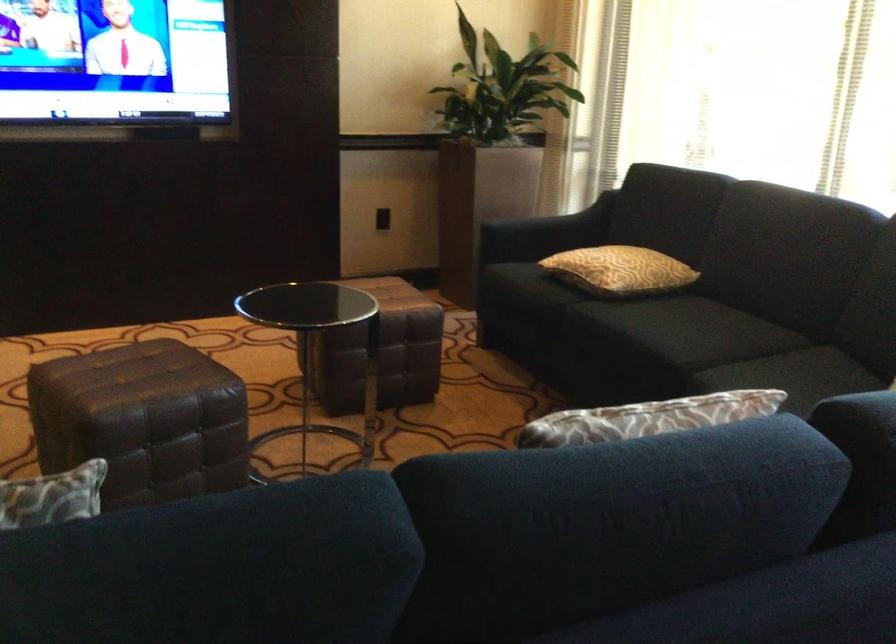
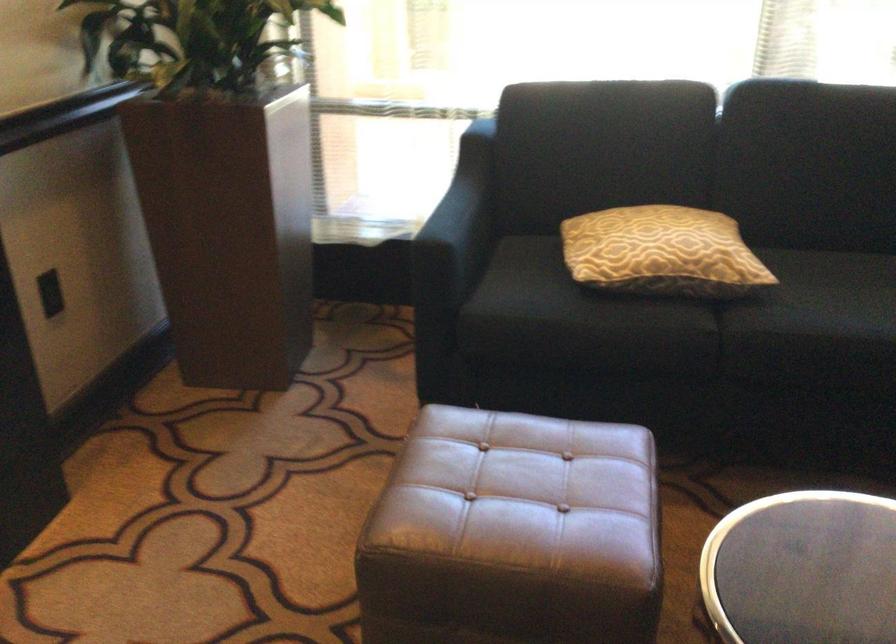
The point at (x=582, y=258) is marked in the first image. Where is the corresponding point in the second image?

(661, 252)